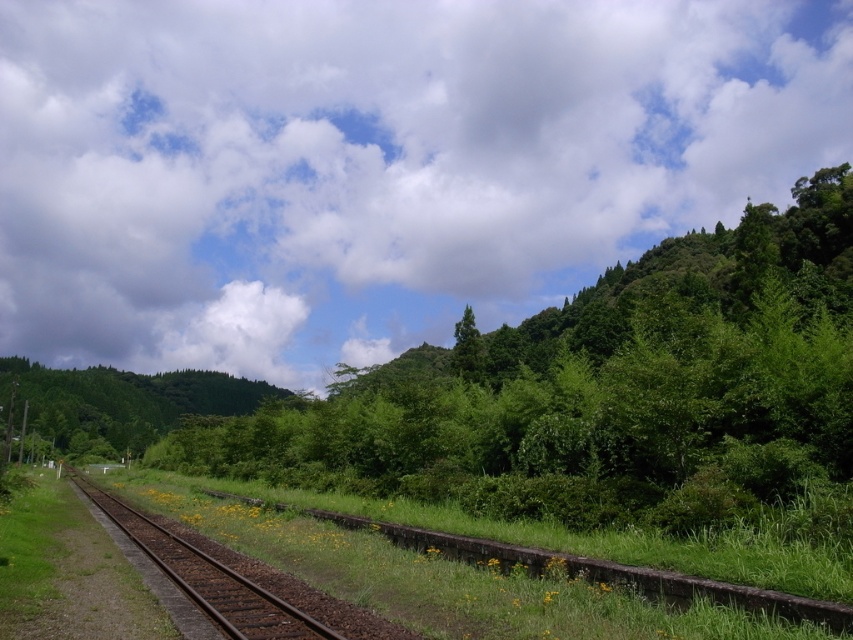
Question: Based on their relative distances, which object is nearer to the green leafy tree at center?

Choices:
 (A) green leafy tree at upper center
 (B) brown metal train track at lower left

Answer: (A)

Question: Which point is farther to the camera?

Choices:
 (A) green leafy tree at center
 (B) brown metal train track at lower left
 (C) green leafy tree at upper center
 (D) brown rusted metal track at center

Answer: (A)

Question: Where is green leafy tree at upper center located in relation to brown rusted metal track at center in the image?

Choices:
 (A) right
 (B) left

Answer: (A)

Question: In this image, where is brown metal train track at lower left located relative to green leafy tree at center?

Choices:
 (A) right
 (B) left

Answer: (B)

Question: Among these objects, which one is nearest to the camera?

Choices:
 (A) green leafy tree at upper center
 (B) brown metal train track at lower left
 (C) brown rusted metal track at center
 (D) green leafy tree at center

Answer: (C)

Question: Does brown rusted metal track at center lie behind brown metal train track at lower left?

Choices:
 (A) no
 (B) yes

Answer: (A)